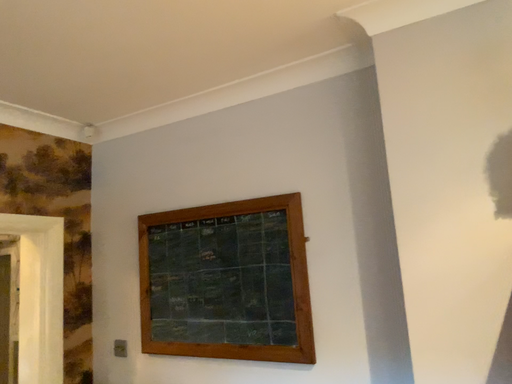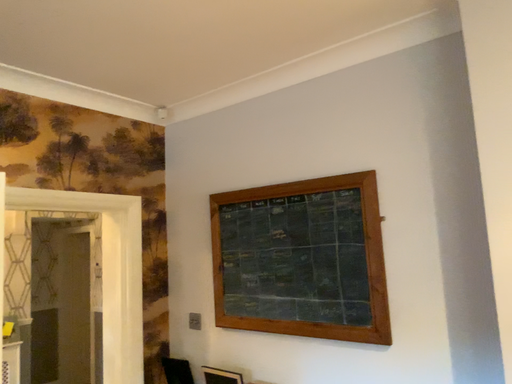
Question: How did the camera likely rotate when shooting the video?

Choices:
 (A) rotated left
 (B) rotated right

Answer: (A)